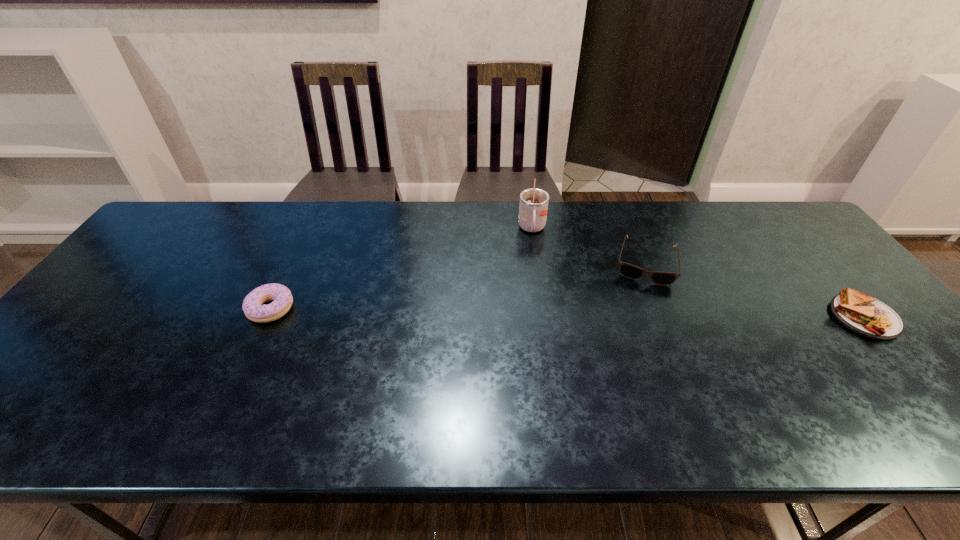
Image resolution: width=960 pixels, height=540 pixels. I want to click on doughnut, so click(253, 307).

Find the location of `sandwich`. sandwich is located at coordinates (861, 313).

Image resolution: width=960 pixels, height=540 pixels. What are the coordinates of `the third object from right to left` in the screenshot? It's located at (533, 208).

The width and height of the screenshot is (960, 540). I want to click on the tallest object, so click(x=533, y=208).

You are a GUI agent. You are given a task and a screenshot of the screen. Output one action in this format:
    pyautogui.click(x=<x>, y=<y>)
    Task: Click on the third object from left to right
    This screenshot has height=540, width=960.
    Given the screenshot: What is the action you would take?
    pyautogui.click(x=630, y=271)

You are a GUI agent. You are given a task and a screenshot of the screen. Output one action in this format:
    pyautogui.click(x=<x>, y=<y>)
    Task: Click on the free space located 0.190m on the front of the doughnut
    This screenshot has height=540, width=960.
    Given the screenshot: What is the action you would take?
    pyautogui.click(x=231, y=393)

Where is `vacant region located 0.290m on the left of the rightmost object`? Image resolution: width=960 pixels, height=540 pixels. vacant region located 0.290m on the left of the rightmost object is located at coordinates (719, 318).

I want to click on free space located on the side with the handle of the third object from right to left, so click(x=536, y=316).

The width and height of the screenshot is (960, 540). In order to click on free space located 0.250m on the side with the handle of the third object from right to left in this screenshot , I will do `click(536, 302)`.

Find the location of a particular element. free space located on the side with the handle of the third object from right to left is located at coordinates coord(534,253).